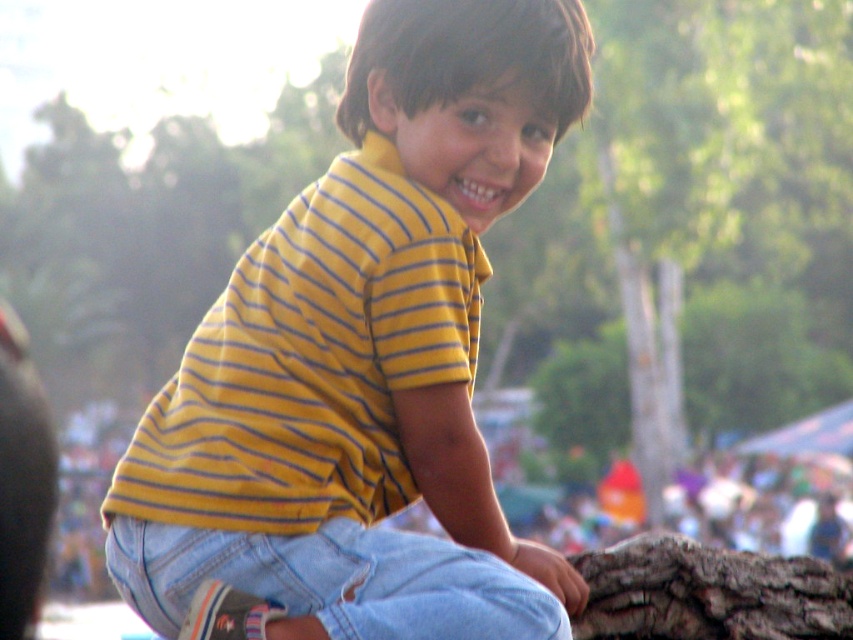
Question: Is denim jeans at lower center below brown rough log at lower right?

Choices:
 (A) no
 (B) yes

Answer: (A)

Question: Does yellow striped shirt at center appear under denim jeans at lower center?

Choices:
 (A) no
 (B) yes

Answer: (A)

Question: Among these objects, which one is farthest from the camera?

Choices:
 (A) brown rough log at lower right
 (B) yellow striped shirt at center

Answer: (A)

Question: Is yellow striped shirt at center in front of brown rough log at lower right?

Choices:
 (A) no
 (B) yes

Answer: (B)

Question: Among these points, which one is nearest to the camera?

Choices:
 (A) (521, 637)
 (B) (837, 570)

Answer: (A)

Question: Which object appears farthest from the camera in this image?

Choices:
 (A) yellow striped shirt at center
 (B) denim jeans at lower center

Answer: (A)